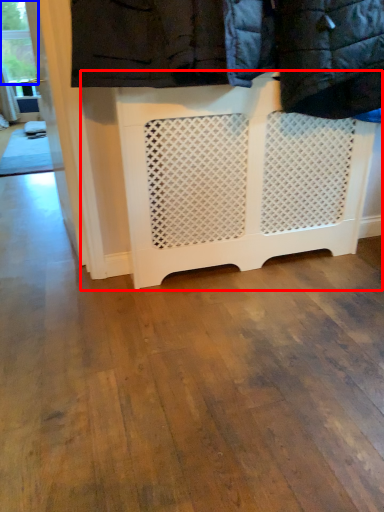
Question: Among these objects, which one is farthest to the camera, furniture (highlighted by a red box) or window frame (highlighted by a blue box)?

Choices:
 (A) furniture
 (B) window frame

Answer: (B)